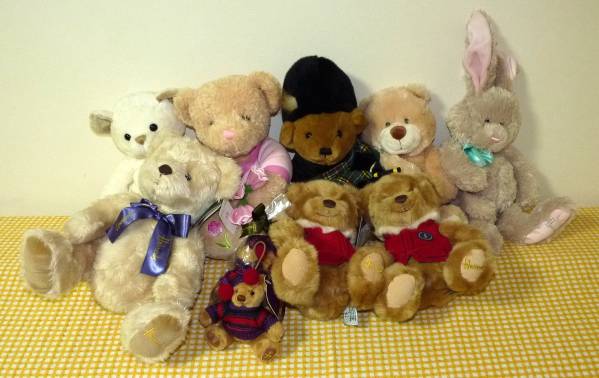
At what (x,y) coordinates should I click in order to perform the action: click on stuffed animals. Please return your answer as a coordinate pair (x, y). Looking at the image, I should click on (164, 224), (143, 124), (199, 123), (243, 297), (332, 249), (400, 225), (407, 136), (316, 123), (503, 134).